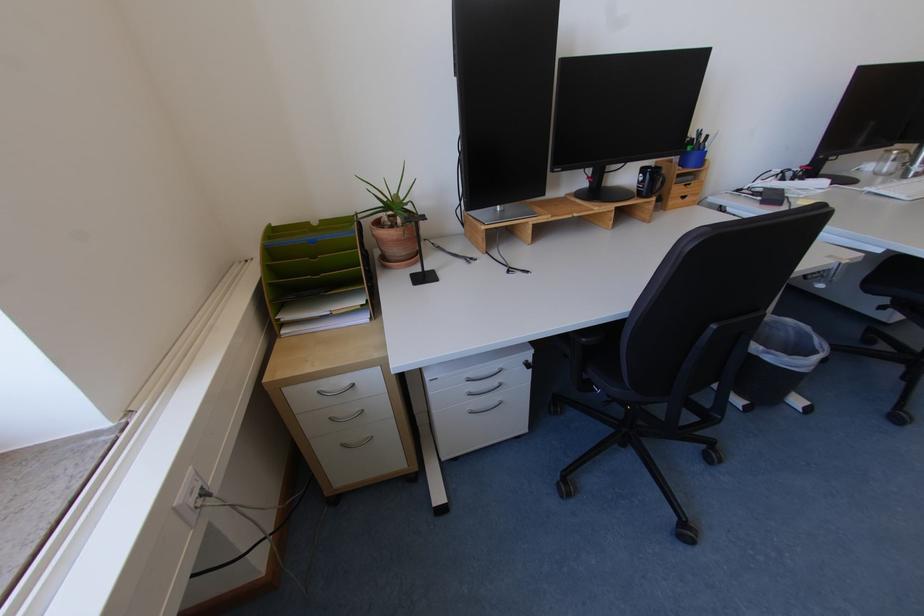
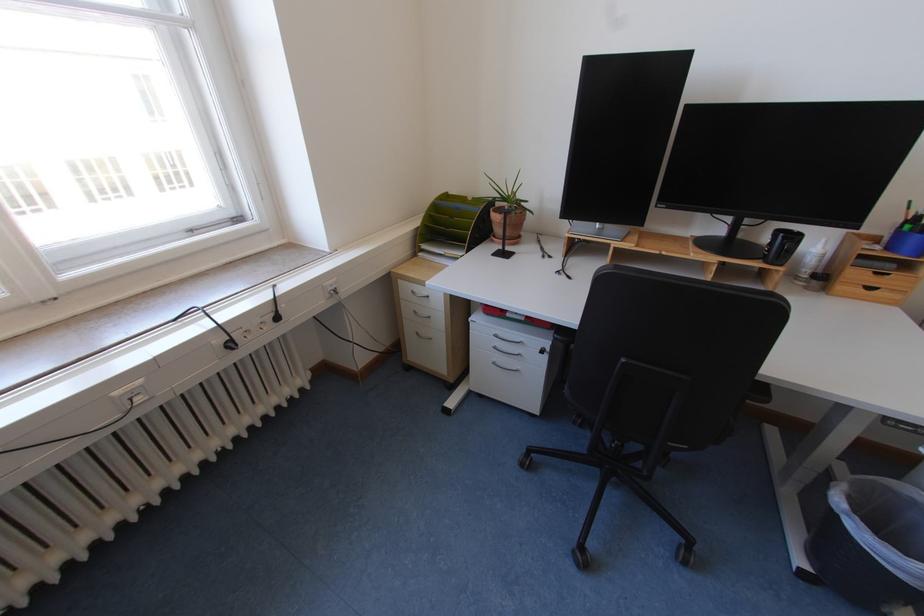
In the second image, find the point that corresponds to (350,446) in the first image.

(426, 334)